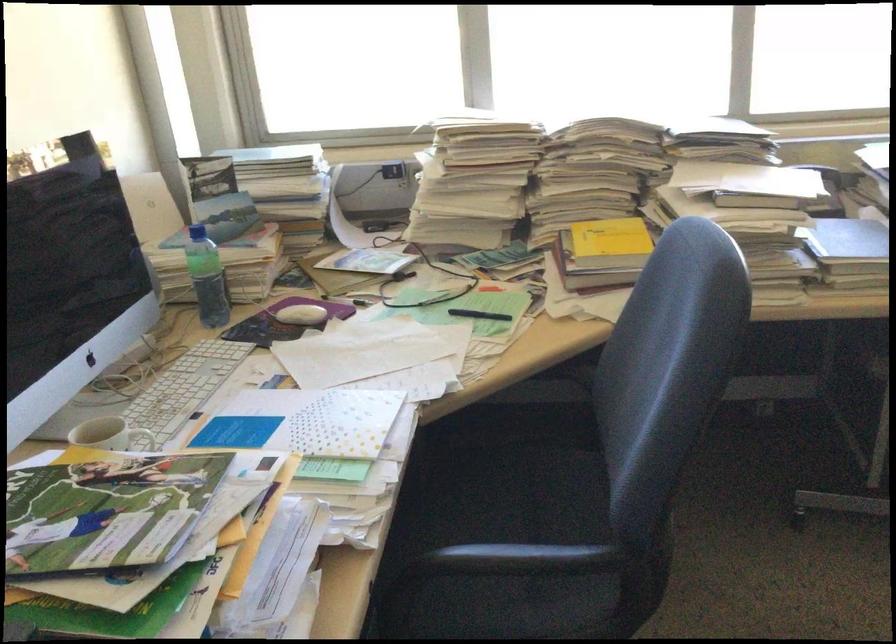
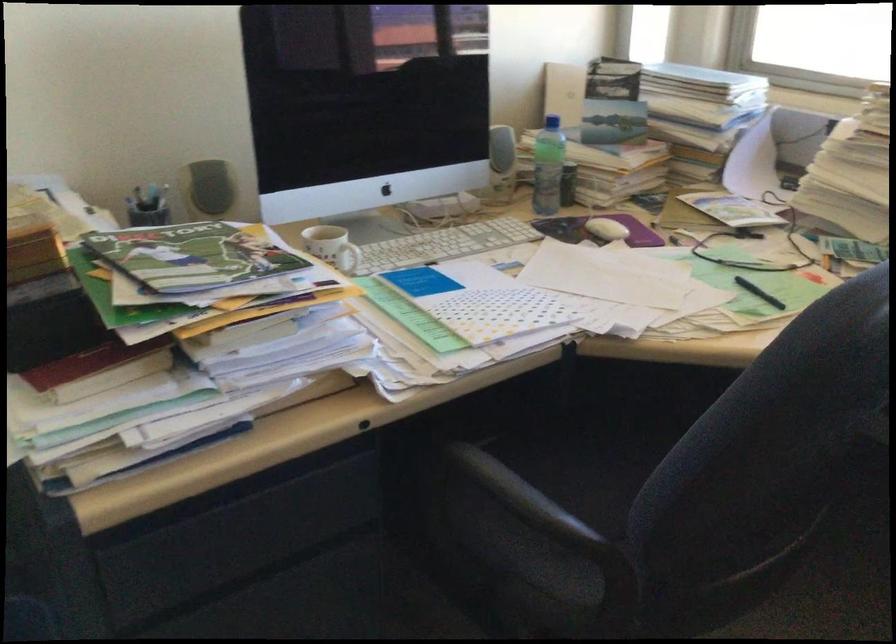
In the second image, find the point that corresponds to point (484, 518) in the first image.

(616, 478)